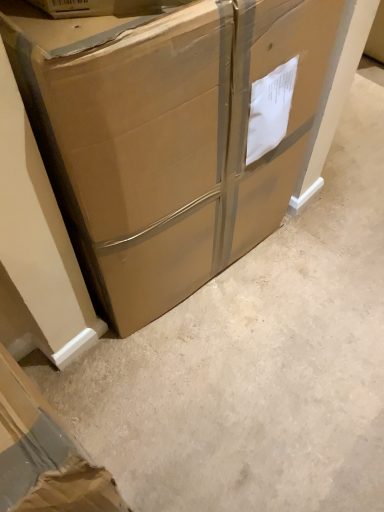
Identify the location of free space on the front side of brown cardboard box at center. (210, 388).